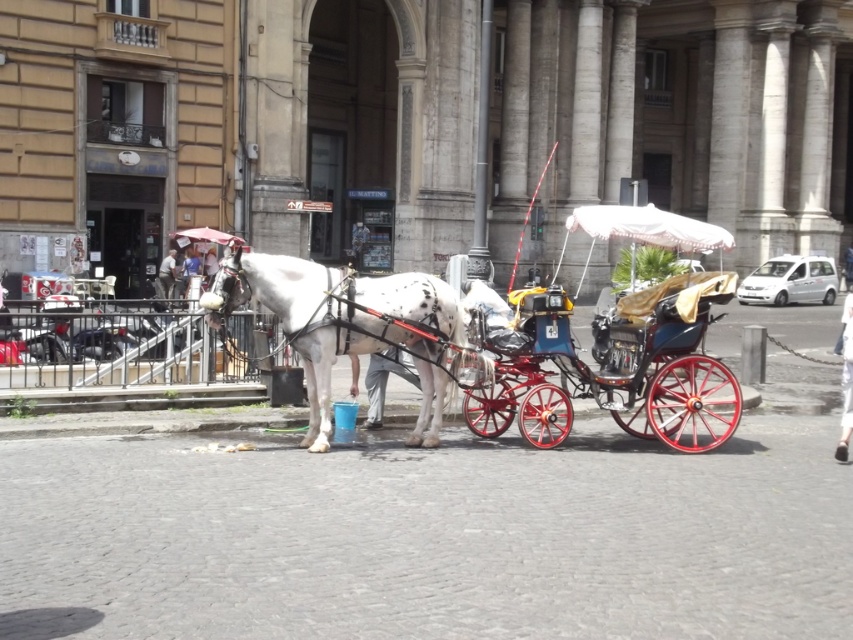
You are a tourist in Rome and want to take a ride on the smaller vehicle. Which one should you choose between the polished wood cart at center and the white leather coach at center?

The polished wood cart at center is smaller than the white leather coach at center, so you should choose the polished wood cart at center for a smaller vehicle.

You are standing at the entrance of the city square and want to take a ride on the polished wood cart at center. Which direction should you walk to reach the cart?

The polished wood cart at center is located at point (611, 368), so you should walk towards the center of the square to reach the cart.